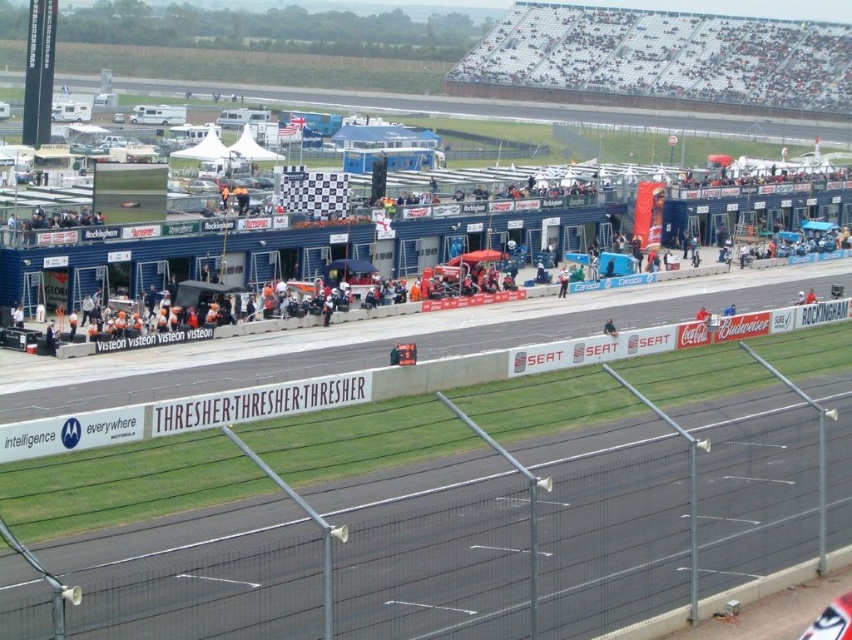
You are a race team member who needs to move from the white plastic banner at center to the white fabric umbrella at center during a break. Given that your equipment cart is 10 feet wide, will there be enough space to navigate between them?

The distance between the white plastic banner at center and the white fabric umbrella at center is 114.18 feet. Since the cart is only 10 feet wide, there is ample space to navigate between them as the distance is significantly larger than the cart width.

You are a spectator at the Rockingham Circuit motorsport event. You see a white plastic banner at center and a white fabric umbrella at center. Which object is taller?

The white fabric umbrella at center is taller than the white plastic banner at center.

You are a photographer at the Rockingham Circuit motorsport event. You need to capture a wide shot of the paddock area but want to ensure that both the white plastic banner at center and the white fabric umbrella at center are clearly visible. Given their sizes, which object should you prioritize positioning closer to the camera to ensure it doesn

The white plastic banner at center is larger in size than the white fabric umbrella at center. To ensure both are clearly visible in your wide shot, position the white plastic banner at center closer to the camera so its larger size remains distinct, while the smaller white fabric umbrella at center can be placed slightly further back but still within frame.